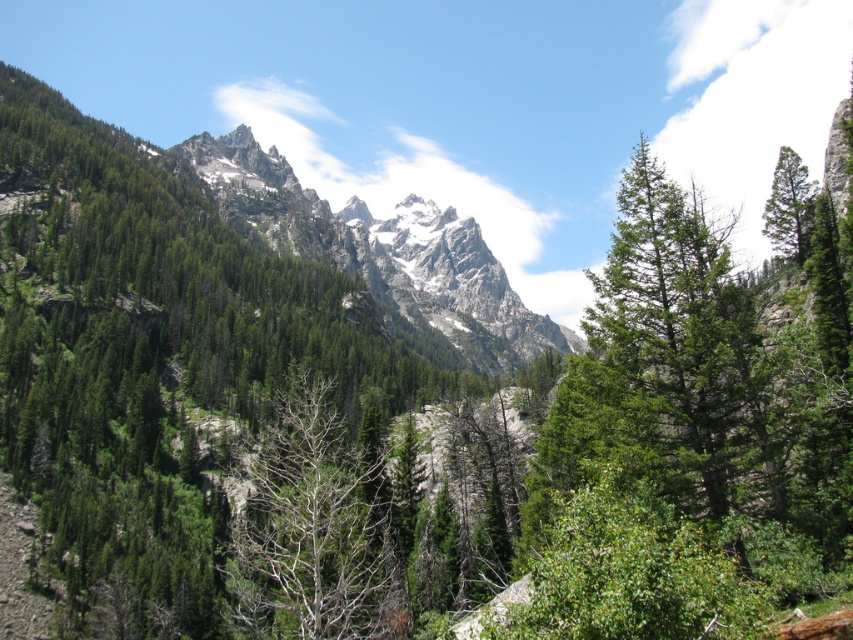
Is point (283, 531) behind point (793, 188)?

No.

The width and height of the screenshot is (853, 640). What do you see at coordinates (312, 529) in the screenshot? I see `bare wood tree at center` at bounding box center [312, 529].

You are a GUI agent. You are given a task and a screenshot of the screen. Output one action in this format:
    pyautogui.click(x=<x>, y=<y>)
    Task: Click on the bare wood tree at center
    The image size is (853, 640).
    Given the screenshot: What is the action you would take?
    pyautogui.click(x=312, y=529)

Does white snow-covered mountain at upper center have a smaller size compared to green matte tree at right?

Actually, white snow-covered mountain at upper center might be larger than green matte tree at right.

How distant is white snow-covered mountain at upper center from green matte tree at right?

The distance of white snow-covered mountain at upper center from green matte tree at right is 233.00 meters.

Locate an element on the screen. white snow-covered mountain at upper center is located at coordinates (381, 252).

Identify the location of white snow-covered mountain at upper center. This screenshot has width=853, height=640. (381, 252).

Does white snow-covered mountain at upper center appear on the left side of bare wood tree at center?

Incorrect, white snow-covered mountain at upper center is not on the left side of bare wood tree at center.

Which is above, white snow-covered mountain at upper center or bare wood tree at center?

Positioned higher is white snow-covered mountain at upper center.

This screenshot has width=853, height=640. I want to click on white snow-covered mountain at upper center, so click(x=381, y=252).